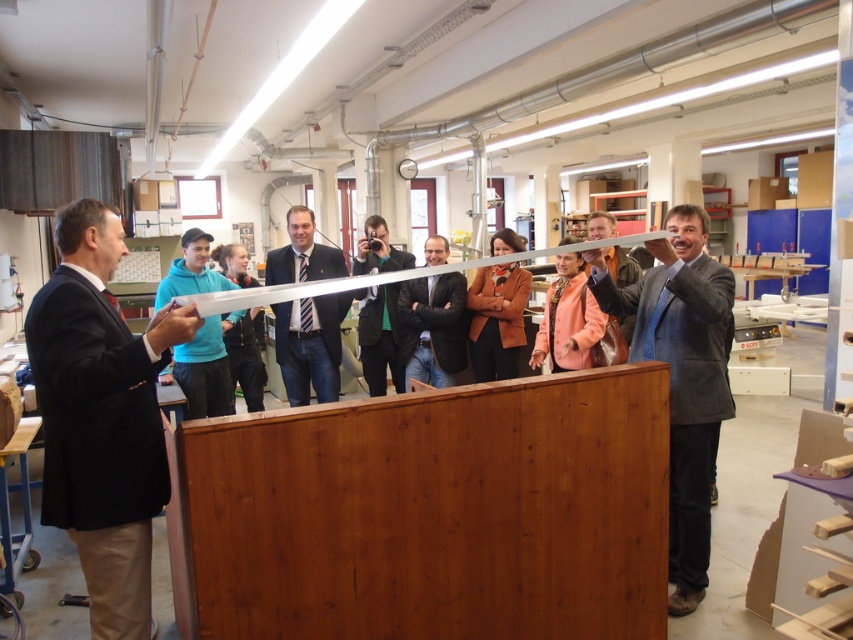
Question: Does black suit at left appear under brown leather jacket at center?

Choices:
 (A) no
 (B) yes

Answer: (B)

Question: Which point appears closest to the camera in this image?

Choices:
 (A) (x=190, y=269)
 (B) (x=381, y=285)

Answer: (A)

Question: Among these objects, which one is farthest from the camera?

Choices:
 (A) green fabric jacket at center
 (B) gray suit at right

Answer: (A)

Question: Which point is closer to the camera?

Choices:
 (A) (506, 262)
 (B) (280, 266)
 (C) (221, 262)

Answer: (A)

Question: Does gray suit at right come in front of brown leather jacket at center?

Choices:
 (A) no
 (B) yes

Answer: (B)

Question: Can you confirm if black suit at left is positioned to the right of orange leather jacket at center?

Choices:
 (A) yes
 (B) no

Answer: (B)